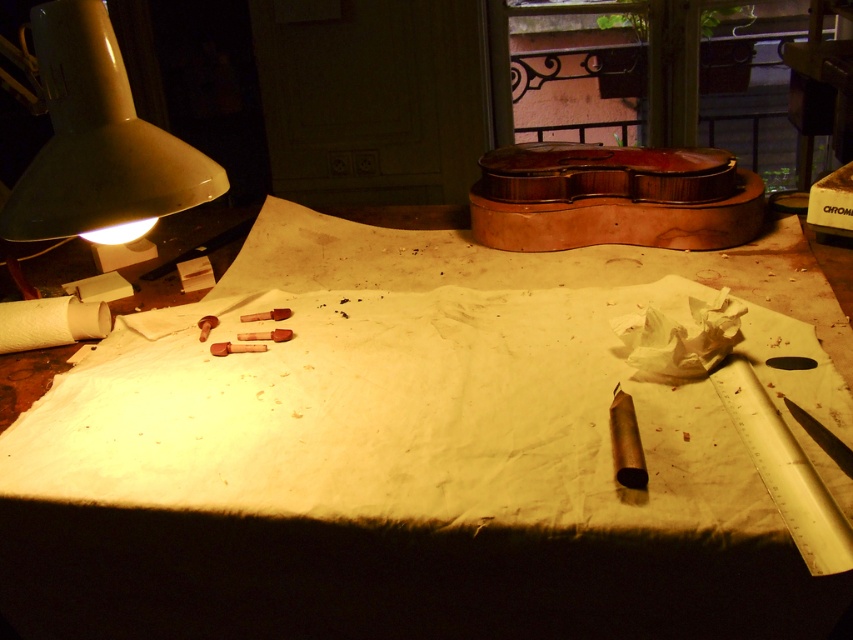
Does white paper at center have a smaller size compared to white paper towel at lower left?

No.

Based on the photo, can you confirm if white paper at center is positioned below white paper towel at lower left?

Actually, white paper at center is above white paper towel at lower left.

You are a GUI agent. You are given a task and a screenshot of the screen. Output one action in this format:
    pyautogui.click(x=<x>, y=<y>)
    Task: Click on the white paper at center
    
    Given the screenshot: What is the action you would take?
    pyautogui.click(x=421, y=451)

Who is higher up, white paper at center or shiny varnished violin at upper center?

Positioned higher is shiny varnished violin at upper center.

The image size is (853, 640). Find the location of `white paper at center`. white paper at center is located at coordinates (421, 451).

Is point (194, 390) farther from viewer compared to point (622, 224)?

No.

This screenshot has height=640, width=853. Find the location of `white paper at center`. white paper at center is located at coordinates (421, 451).

Can you confirm if matte white lamp at upper left is positioned below shiny varnished violin at upper center?

Yes.

Which of these two, matte white lamp at upper left or shiny varnished violin at upper center, stands shorter?

shiny varnished violin at upper center

This screenshot has height=640, width=853. What do you see at coordinates (97, 141) in the screenshot?
I see `matte white lamp at upper left` at bounding box center [97, 141].

This screenshot has width=853, height=640. I want to click on matte white lamp at upper left, so click(x=97, y=141).